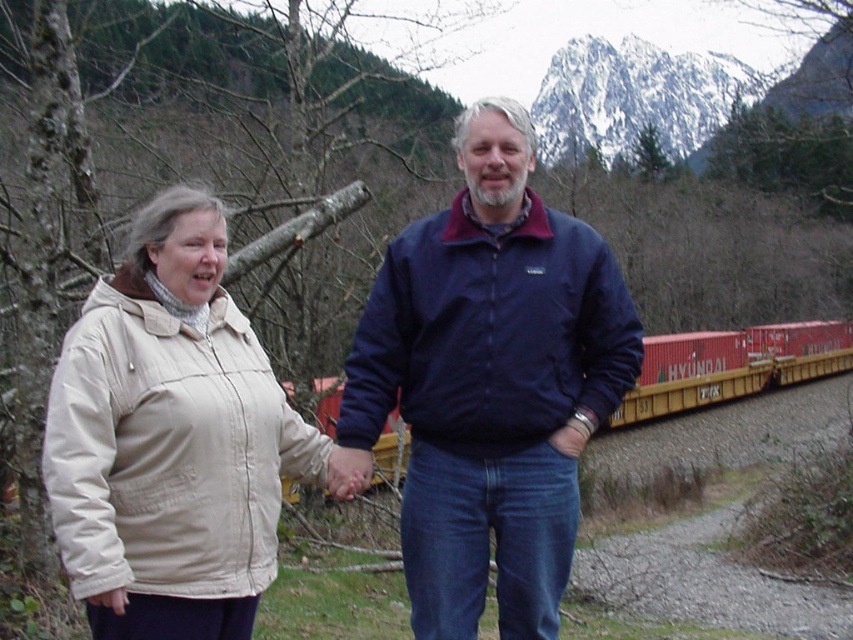
Does navy blue jacket at center have a greater height compared to beige fabric jacket at left?

Indeed, navy blue jacket at center has a greater height compared to beige fabric jacket at left.

Who is more forward, (471, 412) or (233, 419)?

Point (233, 419) is in front.

At what (x,y) coordinates should I click in order to perform the action: click on navy blue jacket at center. Please return your answer as a coordinate pair (x, y). This screenshot has width=853, height=640. Looking at the image, I should click on (489, 384).

Which of these two, navy blue jacket at center or red matte train car at right, stands shorter?

red matte train car at right

Is navy blue jacket at center bigger than red matte train car at right?

No.

Measure the distance between navy blue jacket at center and camera.

navy blue jacket at center is 15.38 meters from camera.

The image size is (853, 640). Find the location of `navy blue jacket at center`. navy blue jacket at center is located at coordinates (489, 384).

Is beige fabric jacket at left to the left of red matte train car at right from the viewer's perspective?

Indeed, beige fabric jacket at left is positioned on the left side of red matte train car at right.

Is beige fabric jacket at left taller than red matte train car at right?

No, beige fabric jacket at left is not taller than red matte train car at right.

The image size is (853, 640). What do you see at coordinates (170, 440) in the screenshot?
I see `beige fabric jacket at left` at bounding box center [170, 440].

Identify the location of beige fabric jacket at left. This screenshot has width=853, height=640. (170, 440).